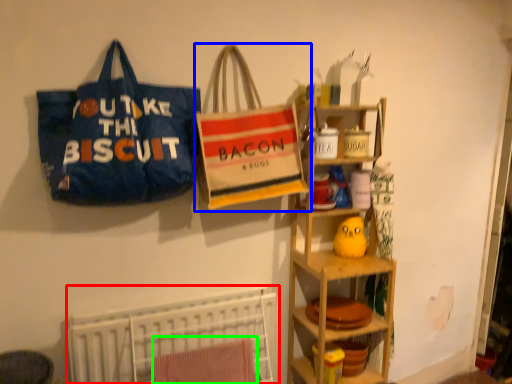
Question: Which object is positioned farthest from bed (highlighted by a red box)? Select from handbag (highlighted by a blue box) and beach towel (highlighted by a green box).

Choices:
 (A) handbag
 (B) beach towel

Answer: (A)